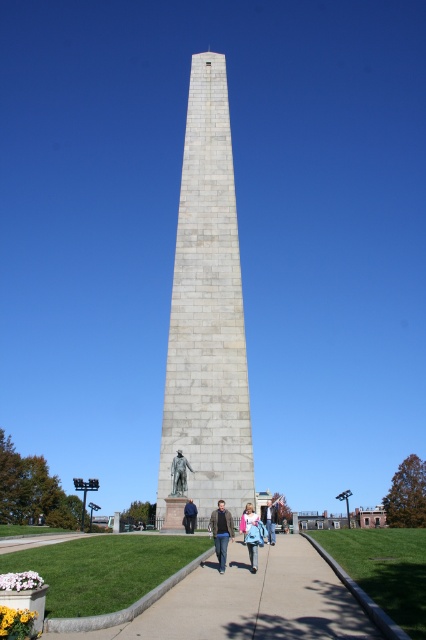
You are standing at the base of the obelisk monument and notice a denim jacket at lower center and blue denim jeans at center. If you want to retrieve both items, which one should you pick up first to minimize the distance walked?

You should pick up the blue denim jeans at center first since it is closer to your starting position at the base of the obelisk monument. The denim jacket at lower center is 37.50 meters away from the blue denim jeans at center, implying the jacket is farther away.